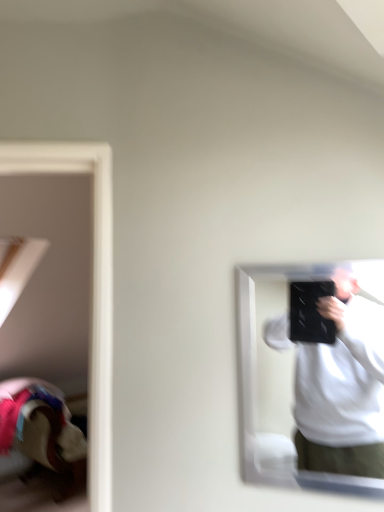
Question: Should I look upward or downward to see white matte shirt at right?

Choices:
 (A) down
 (B) up

Answer: (A)